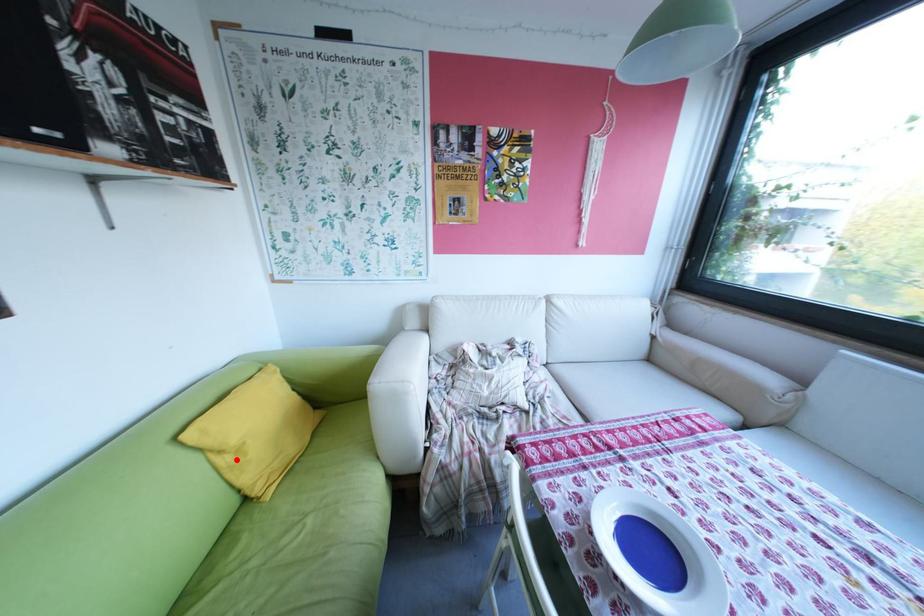
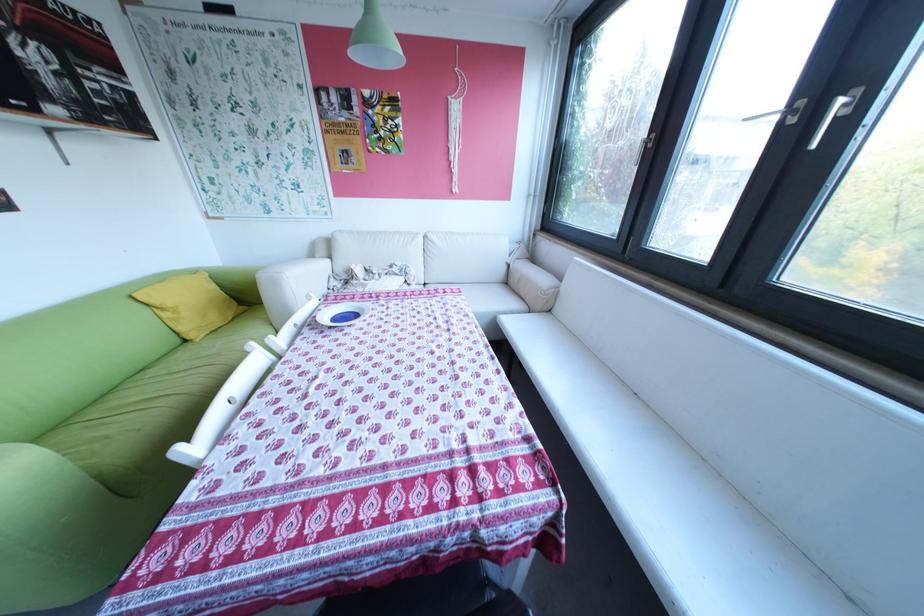
The point at the highlighted location is marked in the first image. Where is the corresponding point in the second image?

(177, 314)